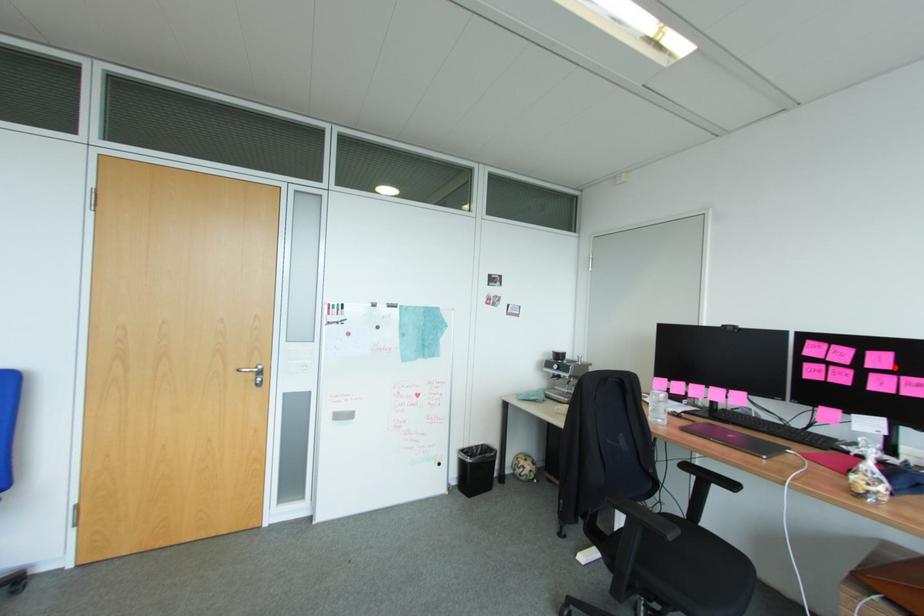
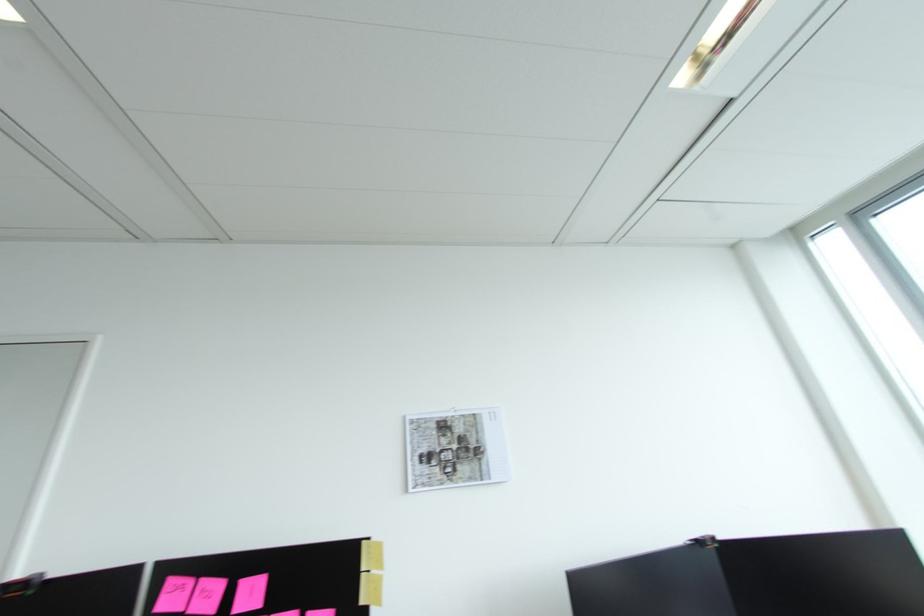
Locate, in the second image, the point that corresponds to the highlighted location in the first image.

(262, 605)